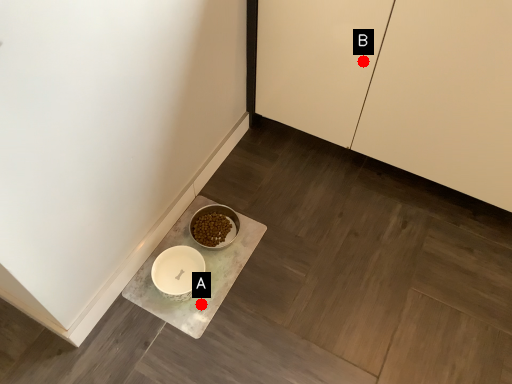
Question: Two points are circled on the image, labeled by A and B beside each circle. Which point is further to the camera?

Choices:
 (A) A is further
 (B) B is further

Answer: (A)